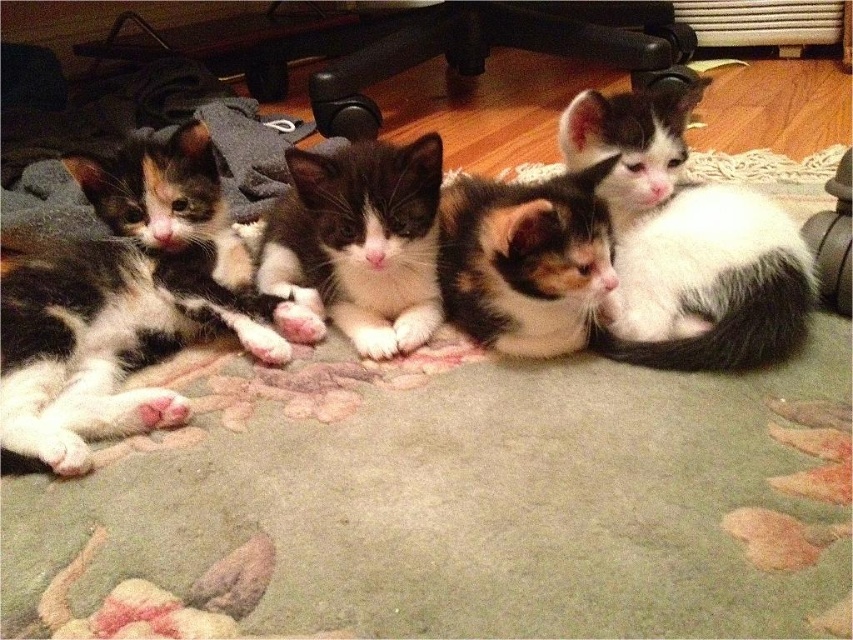
You are a photographer trying to capture a closeup of the calico fur kitten at left and the white and black fur cat at upper right. Since you want both kittens to be in focus, which one should you focus on first to ensure the other is also in focus?

The calico fur kitten at left is larger than the white and black fur cat at upper right. To ensure both are in focus, you should focus on the calico fur kitten at left first because it is closer to the camera, allowing the smaller one to be within the depth of field.

You are a photographer trying to capture a closeup of the calico fur kitten at left. Based on its position in the image, where should you focus your camera lens to ensure it is centered in the frame?

The calico fur kitten at left is located at point [126,305], so you should focus your camera lens at those coordinates to center it in the frame.

You are looking at the image of four kittens on a carpet. You notice a white and black fur cat at upper right. Can you tell me the exact coordinates where this cat is located?

The white and black fur cat at upper right is located at coordinates point (686, 243).